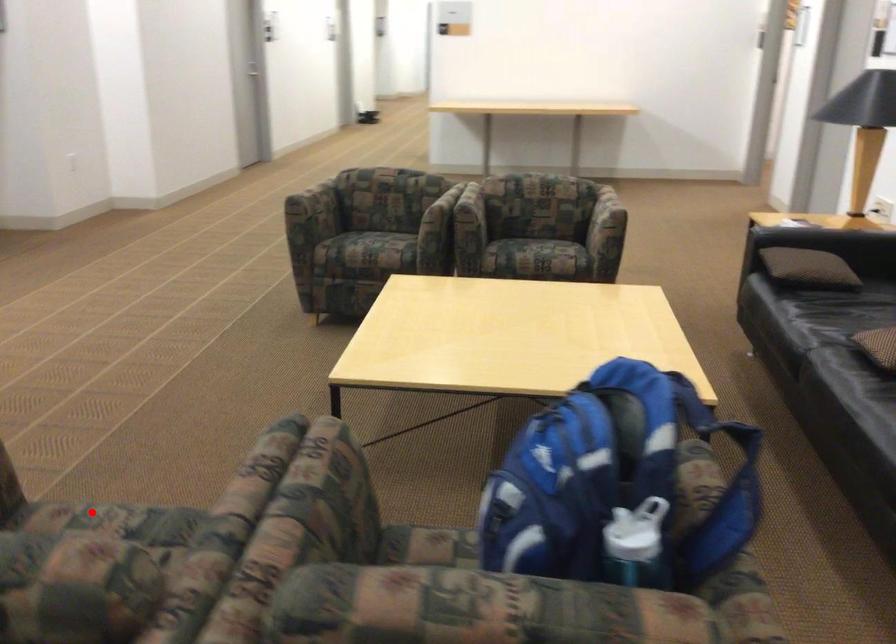
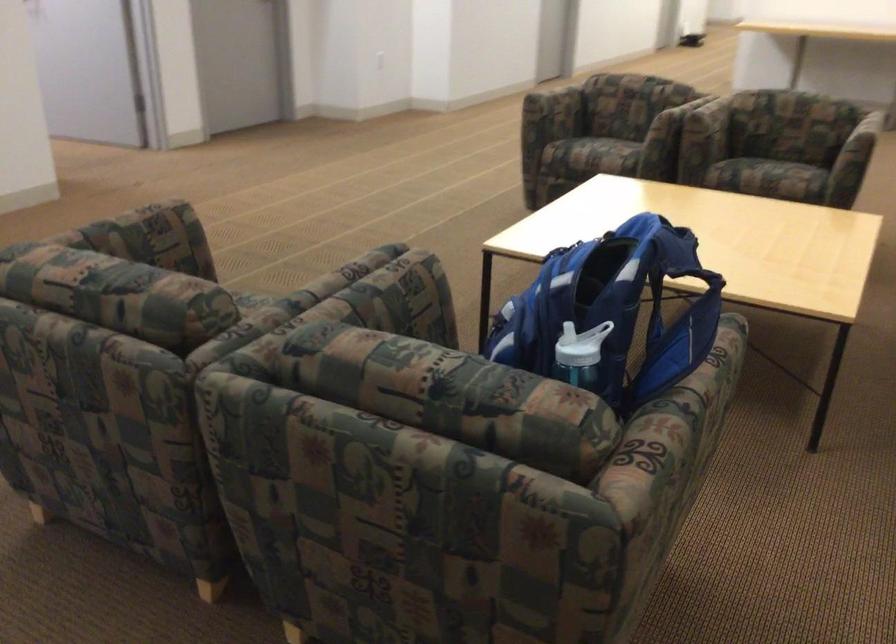
In the second image, find the point that corresponds to the highlighted location in the first image.

(250, 298)